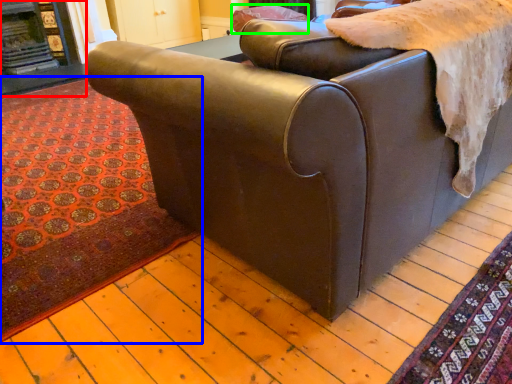
Question: Which is farther away from fireplace (highlighted by a red box)? mat (highlighted by a blue box) or pillow (highlighted by a green box)?

Choices:
 (A) mat
 (B) pillow

Answer: (B)